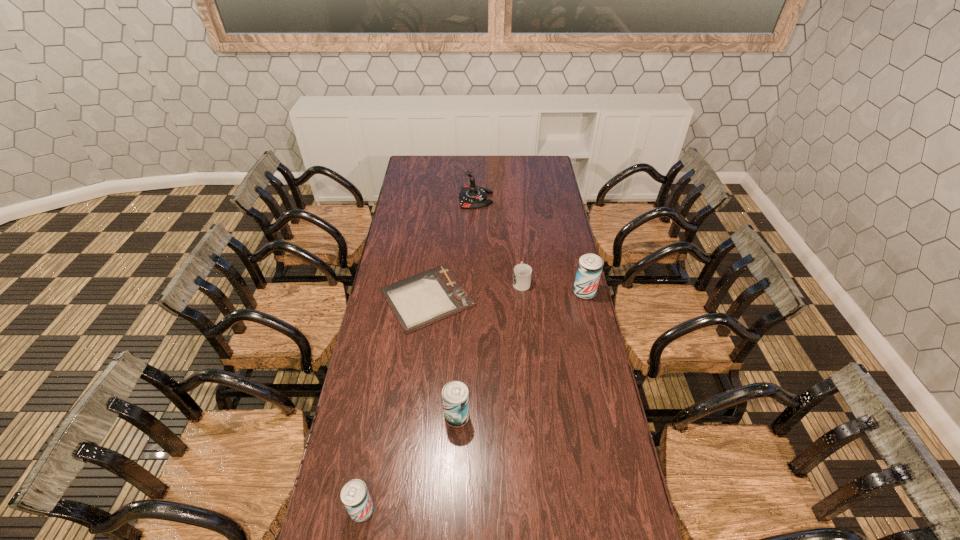
At what (x,y) coordinates should I click in order to perform the action: click on vacant space in between the second shortest beer can and the second shortest object. Please return your answer as a coordinate pair (x, y). This screenshot has height=540, width=960. Looking at the image, I should click on (490, 349).

The height and width of the screenshot is (540, 960). I want to click on empty space between the leftmost beer can and the rightmost object, so click(x=473, y=401).

Locate an element on the screen. free space between the farthest beer can and the joystick is located at coordinates (530, 245).

Locate an element on the screen. This screenshot has width=960, height=540. vacant region between the shortest object and the joystick is located at coordinates pyautogui.click(x=451, y=248).

Identify the location of vacant area that lies between the fifth farthest object and the rightmost object. (520, 355).

Identify the location of free space between the shortest object and the second farthest beer can. This screenshot has height=540, width=960. (443, 357).

Find the location of a particular element. The image size is (960, 540). vacant space that's between the joystick and the rightmost beer can is located at coordinates (530, 245).

You are a GUI agent. You are given a task and a screenshot of the screen. Output one action in this format:
    pyautogui.click(x=<x>, y=<y>)
    Task: Click on the blank region between the cup and the rightmost object
    This screenshot has height=540, width=960.
    Given the screenshot: What is the action you would take?
    pyautogui.click(x=553, y=287)

Find the location of a particular element. object identified as the fifth closest to the fifth farthest object is located at coordinates (471, 197).

The width and height of the screenshot is (960, 540). I want to click on object that stands as the fourth closest to the second object from right to left, so click(455, 394).